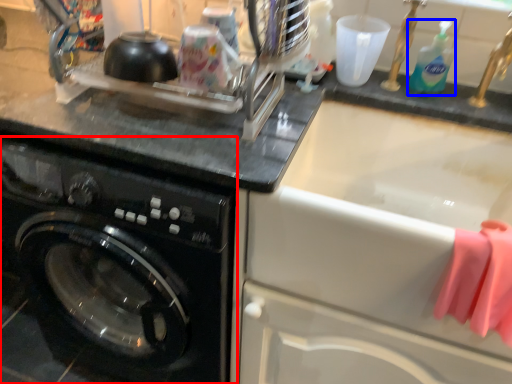
Question: Which point is closer to the camera, washing machine (highlighted by a red box) or cleaning product (highlighted by a blue box)?

Choices:
 (A) washing machine
 (B) cleaning product

Answer: (A)